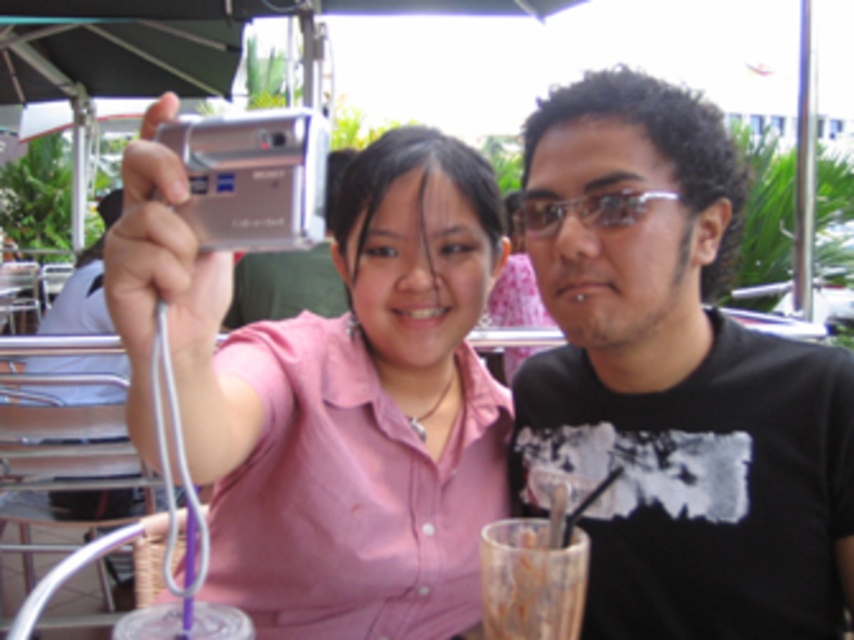
You are standing at a point 3.40 feet away from the point marked at coordinates (595, 156) in the image. If you want to move closer to that point, which direction should you walk relative to your current position?

Since the point marked at coordinates (595, 156) is 3.40 feet away from your current position, you should walk towards the point to get closer. The exact direction depends on the layout of the scene, but moving straight towards the point would reduce the distance.

You are a waiter at the outdoor cafe and need to deliver a drink to the customer. The customer points to the translucent glass cup at lower center and the transparent plastic glasses at center. Which object should you pick up first to avoid blocking the view of the other?

You should pick up the translucent glass cup at lower center first because it is in front of the transparent plastic glasses at center, so removing it first will prevent blocking the view of the glasses.

You are a photographer trying to capture a clear shot of both the black matte shirt at right and the silver metallic camera at upper left. Which object should you focus on first to ensure it appears in focus, considering their heights?

The black matte shirt at right has a lesser height compared to the silver metallic camera at upper left, so you should focus on the silver metallic camera at upper left first to ensure it is in focus.